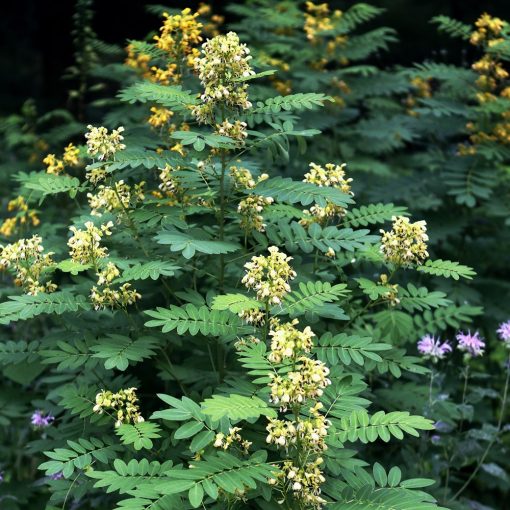
Where is `far right flower`? This screenshot has height=510, width=510. far right flower is located at coordinates (504, 332).